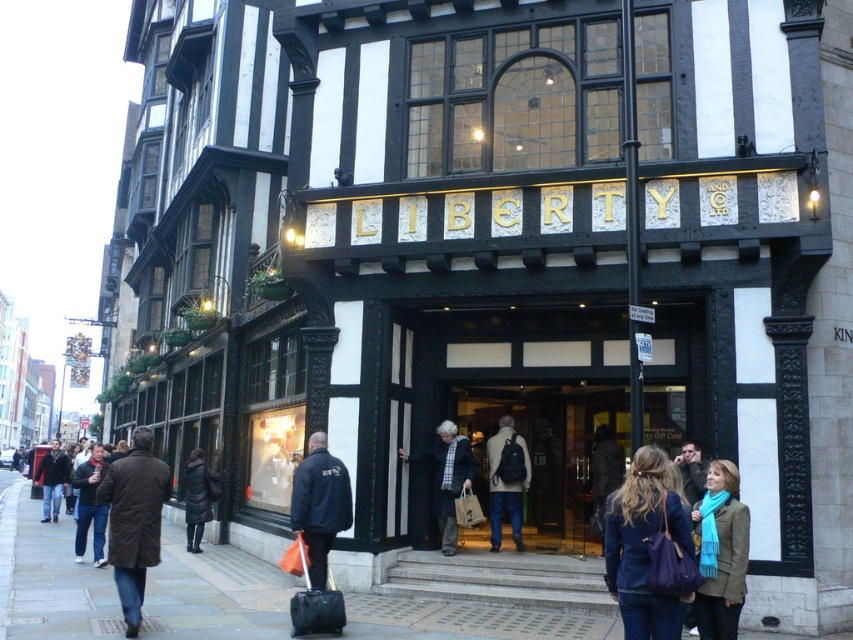
You are standing at the entrance of the historic building and need to carry a large black jacket at center through the matte black door at center. Based on their sizes, can the jacket fit through the door without any adjustments?

The matte black door at center is wider than the black jacket at center, so the jacket can fit through the door without needing adjustments.